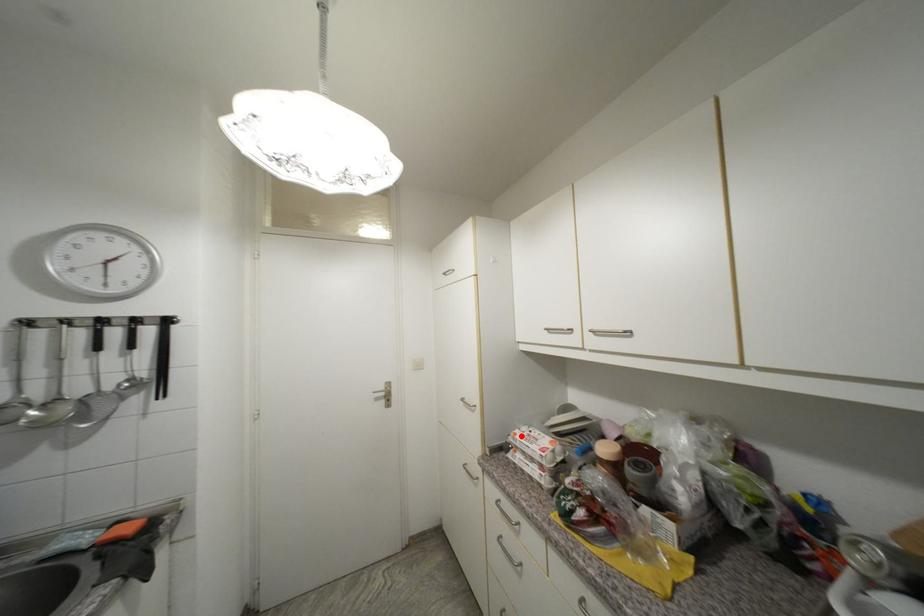
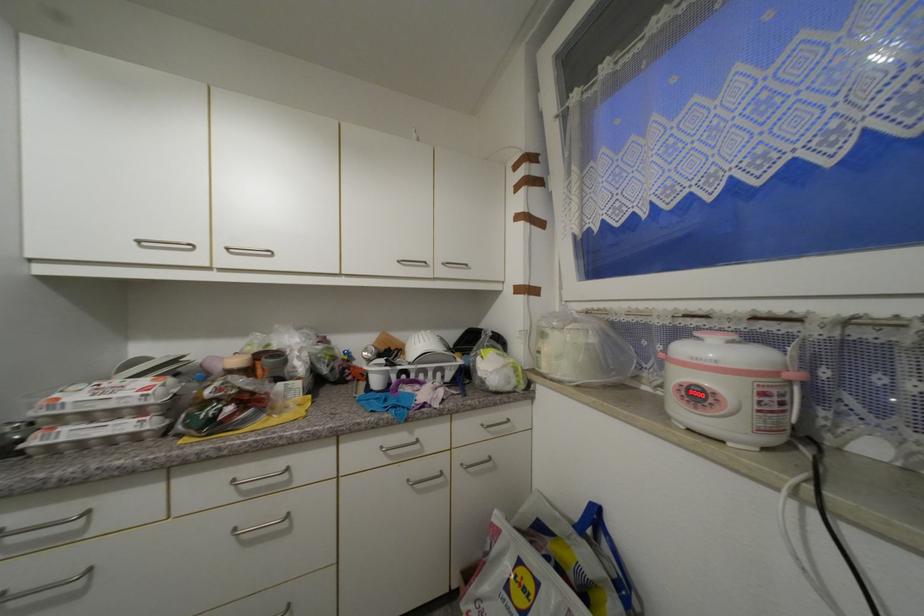
Question: I am providing you with two images of the same scene from different viewpoints. A red point is marked on the first image. Is the red point's position out of view in image 2?

Choices:
 (A) Yes
 (B) No

Answer: (B)